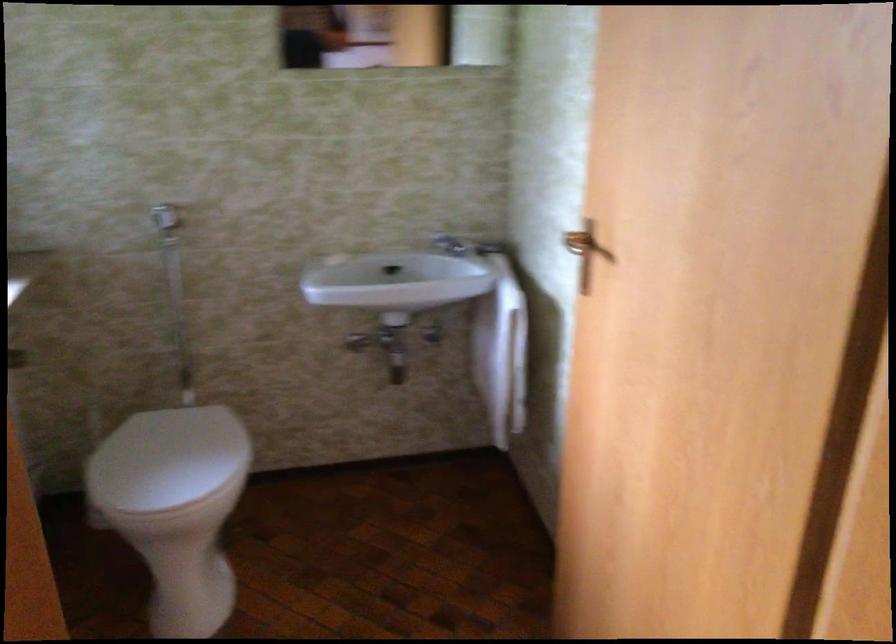
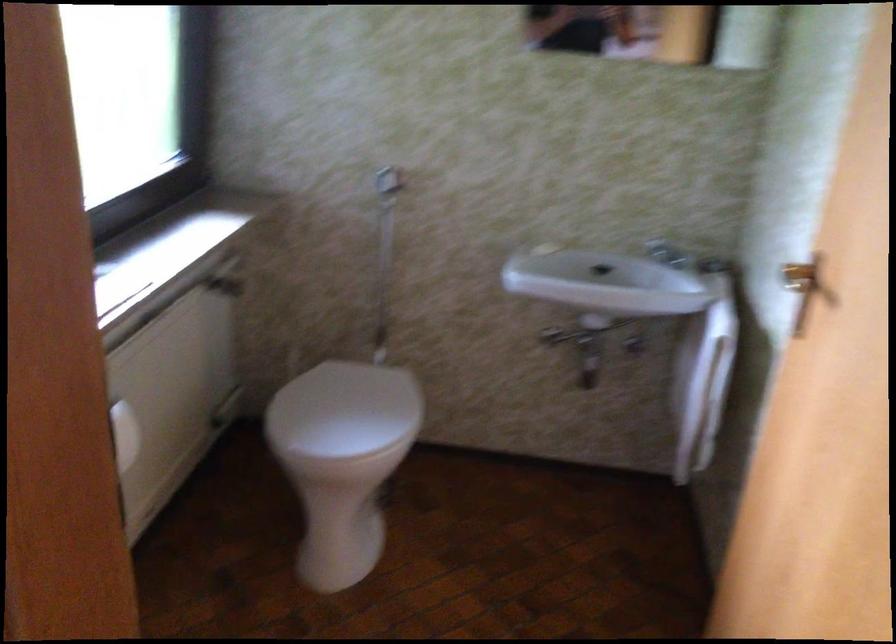
Question: The camera is either moving clockwise (left) or counter-clockwise (right) around the object. The first image is from the beginning of the video and the second image is from the end. Is the camera moving left or right when shooting the video?

Choices:
 (A) Left
 (B) Right

Answer: (B)